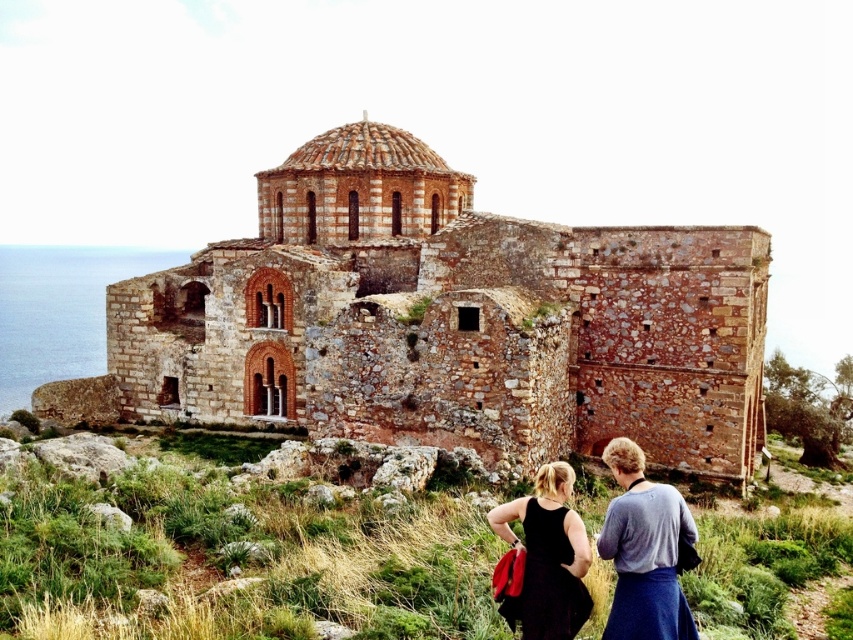
You are a photographer aiming to capture both the black fabric dress at lower center and the black fabric dress at lower right in a single frame. Given their sizes, which dress should you focus on to ensure both are clearly visible in the photo?

The black fabric dress at lower center is larger in size than the black fabric dress at lower right. To ensure both are clearly visible, focus on the larger dress at lower center while adjusting the camera angle to include the smaller one in the background or periphery.

You are a photographer trying to capture the rustic stone church at center and the black fabric dress at lower right in the same frame. Based on their relative sizes in the image, which object appears larger?

The rustic stone church at center appears larger than the black fabric dress at lower right because it is taller.